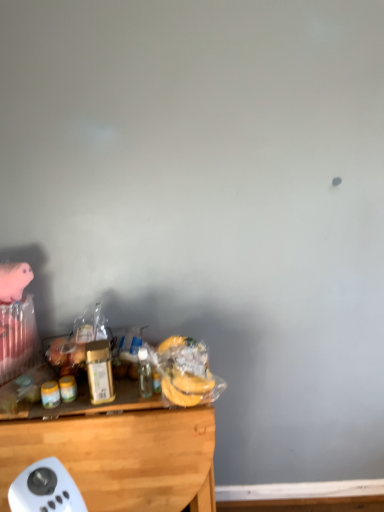
Question: Does translucent plastic bottle at center, marked as the first bottle in a right-to-left arrangement, come in front of wooden desk at lower left?

Choices:
 (A) no
 (B) yes

Answer: (A)

Question: Does translucent plastic bottle at center, marked as the first bottle in a right-to-left arrangement, have a greater width compared to wooden desk at lower left?

Choices:
 (A) no
 (B) yes

Answer: (A)

Question: Would you say translucent plastic bottle at center, marked as the first bottle in a right-to-left arrangement, contains wooden desk at lower left?

Choices:
 (A) no
 (B) yes

Answer: (A)

Question: Is translucent plastic bottle at center, the 2th bottle in the left-to-right sequence, aimed at wooden desk at lower left?

Choices:
 (A) yes
 (B) no

Answer: (B)

Question: Does translucent plastic bottle at center, the 2th bottle in the left-to-right sequence, have a lesser width compared to wooden desk at lower left?

Choices:
 (A) yes
 (B) no

Answer: (A)

Question: Is translucent plastic bottle at center, marked as the first bottle in a right-to-left arrangement, not inside wooden desk at lower left?

Choices:
 (A) yes
 (B) no

Answer: (A)

Question: Is the position of translucent plastic bottle at center, marked as the first bottle in a right-to-left arrangement, less distant than that of translucent plastic bananas at lower center, arranged as the second food when viewed from the left?

Choices:
 (A) no
 (B) yes

Answer: (A)

Question: Considering the relative sizes of translucent plastic bottle at center, marked as the first bottle in a right-to-left arrangement, and translucent plastic bananas at lower center, arranged as the second food when viewed from the left, in the image provided, is translucent plastic bottle at center, marked as the first bottle in a right-to-left arrangement, bigger than translucent plastic bananas at lower center, arranged as the second food when viewed from the left,?

Choices:
 (A) yes
 (B) no

Answer: (B)

Question: Is translucent plastic bottle at center, the 2th bottle in the left-to-right sequence, at the right side of translucent plastic bananas at lower center, arranged as the second food when viewed from the left?

Choices:
 (A) no
 (B) yes

Answer: (A)

Question: Is translucent plastic bottle at center, the 2th bottle in the left-to-right sequence, beside translucent plastic bananas at lower center, arranged as the second food when viewed from the left?

Choices:
 (A) no
 (B) yes

Answer: (A)

Question: Is translucent plastic bottle at center, marked as the first bottle in a right-to-left arrangement, thinner than translucent plastic bananas at lower center, arranged as the second food when viewed from the left?

Choices:
 (A) no
 (B) yes

Answer: (B)

Question: Is translucent plastic bottle at center, marked as the first bottle in a right-to-left arrangement, positioned behind translucent plastic bananas at lower center, arranged as the second food when viewed from the left?

Choices:
 (A) yes
 (B) no

Answer: (A)

Question: From the image's perspective, is yellow matte jar at left, the 1th food in the left-to-right sequence, above translucent plastic bottle at center, the 2th bottle in the left-to-right sequence?

Choices:
 (A) no
 (B) yes

Answer: (A)